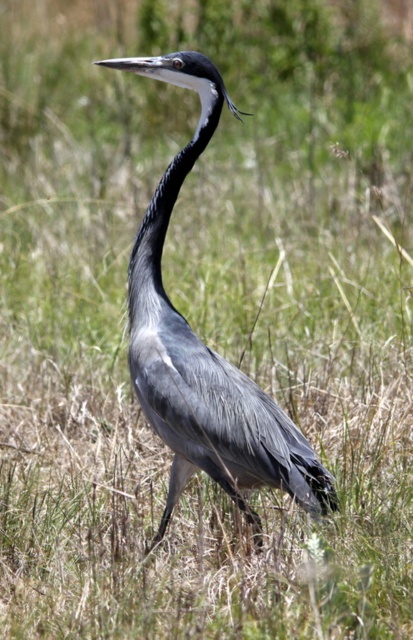
Question: Which of the following is the farthest from the observer?

Choices:
 (A) gray feathered heron at center
 (B) smooth grey neck at center

Answer: (B)

Question: Observing the image, what is the correct spatial positioning of gray feathered heron at center in reference to smooth grey neck at center?

Choices:
 (A) left
 (B) right

Answer: (B)

Question: Can you confirm if gray feathered heron at center is positioned to the left of smooth grey neck at center?

Choices:
 (A) no
 (B) yes

Answer: (A)

Question: Can you confirm if gray feathered heron at center is positioned to the left of smooth grey neck at center?

Choices:
 (A) yes
 (B) no

Answer: (B)

Question: Which object appears closest to the camera in this image?

Choices:
 (A) smooth grey neck at center
 (B) gray feathered heron at center

Answer: (B)

Question: Which point is farther from the camera taking this photo?

Choices:
 (A) (253, 394)
 (B) (213, 88)

Answer: (A)